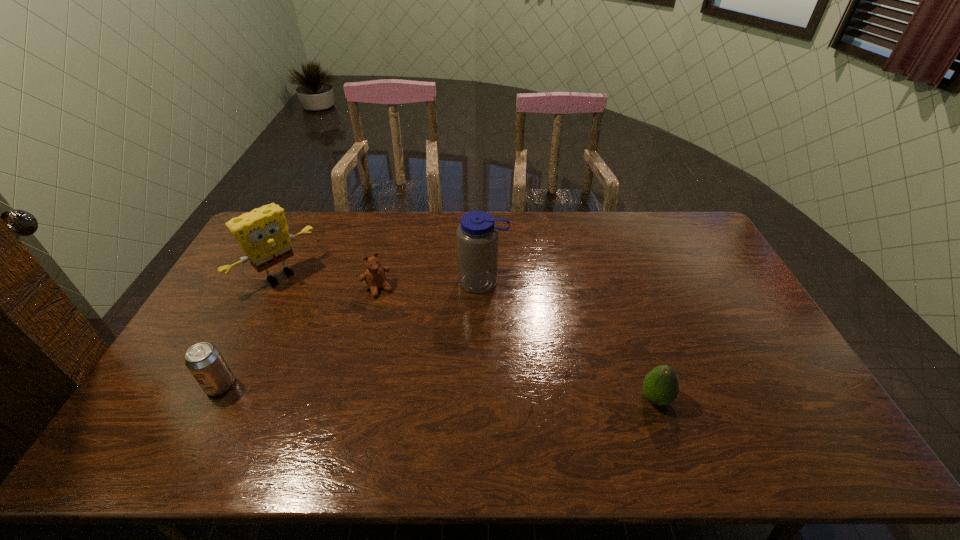
The image size is (960, 540). Identify the location of vacant space situated 0.330m on the face of the teddy bear. (431, 370).

Locate an element on the screen. This screenshot has height=540, width=960. blank area located on the face of the teddy bear is located at coordinates (440, 383).

Where is `free point located on the face of the teddy bear`? This screenshot has width=960, height=540. free point located on the face of the teddy bear is located at coordinates (418, 350).

This screenshot has width=960, height=540. Find the location of `blank space located on the face of the sponge`. blank space located on the face of the sponge is located at coordinates (303, 300).

This screenshot has width=960, height=540. In order to click on free space located 0.260m on the face of the sponge in this screenshot , I will do pos(341,335).

This screenshot has height=540, width=960. Find the location of `vacant space located on the face of the sponge`. vacant space located on the face of the sponge is located at coordinates (335, 329).

The height and width of the screenshot is (540, 960). In order to click on beer can situated at the near edge in this screenshot , I will do `click(205, 362)`.

You are a GUI agent. You are given a task and a screenshot of the screen. Output one action in this format:
    pyautogui.click(x=<x>, y=<y>)
    Task: Click on the avocado located at the near edge
    Image resolution: width=960 pixels, height=540 pixels.
    Given the screenshot: What is the action you would take?
    pyautogui.click(x=660, y=386)

Find the location of `beer can that is at the left edge`. beer can that is at the left edge is located at coordinates (205, 362).

Find the location of `sponge positioned at the left edge`. sponge positioned at the left edge is located at coordinates (262, 234).